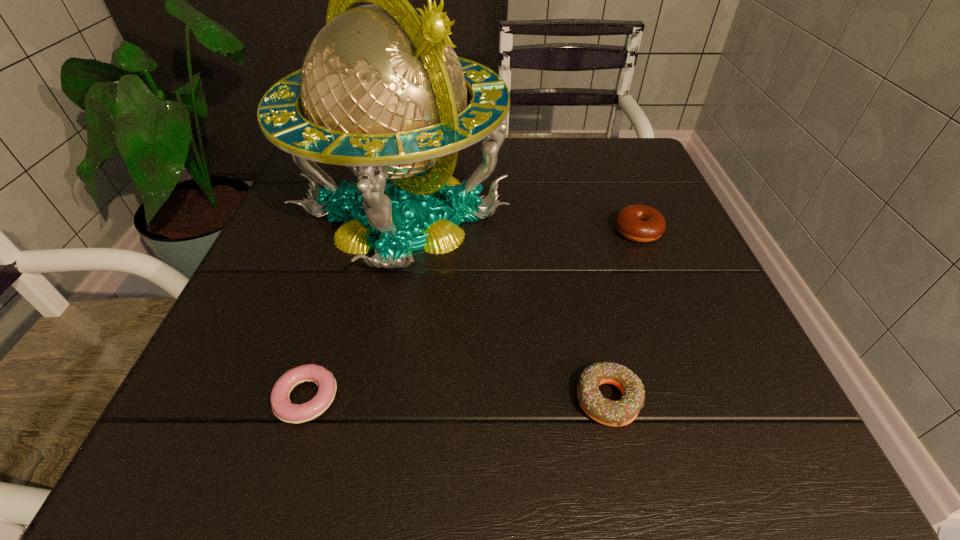
Locate an element on the screen. This screenshot has height=540, width=960. vacant region between the leftmost doughnut and the second doughnut from left to right is located at coordinates (457, 399).

Find the location of `free point between the rightmost doughnut and the shortest doughnut`. free point between the rightmost doughnut and the shortest doughnut is located at coordinates (472, 314).

Image resolution: width=960 pixels, height=540 pixels. What are the coordinates of `the third closest object to the tallest object` in the screenshot? It's located at (640, 223).

Locate which object is the third closest to the rightmost doughnut. Please provide its 2D coordinates. Your answer should be formatted as a tuple, i.e. [(x, y)], where the tuple contains the x and y coordinates of a point satisfying the conditions above.

[(281, 405)]

Choose which doughnut is the nearest neighbor to the farthest doughnut. Please provide its 2D coordinates. Your answer should be formatted as a tuple, i.e. [(x, y)], where the tuple contains the x and y coordinates of a point satisfying the conditions above.

[(621, 412)]

The height and width of the screenshot is (540, 960). Identify the location of doughnut identified as the second closest to the second shortest object. (281, 405).

Where is `vacant space that satisfies the following two spatial constraints: 1. on the back side of the farthest doughnut; 2. on the right side of the shortest doughnut`? The height and width of the screenshot is (540, 960). vacant space that satisfies the following two spatial constraints: 1. on the back side of the farthest doughnut; 2. on the right side of the shortest doughnut is located at coordinates (358, 231).